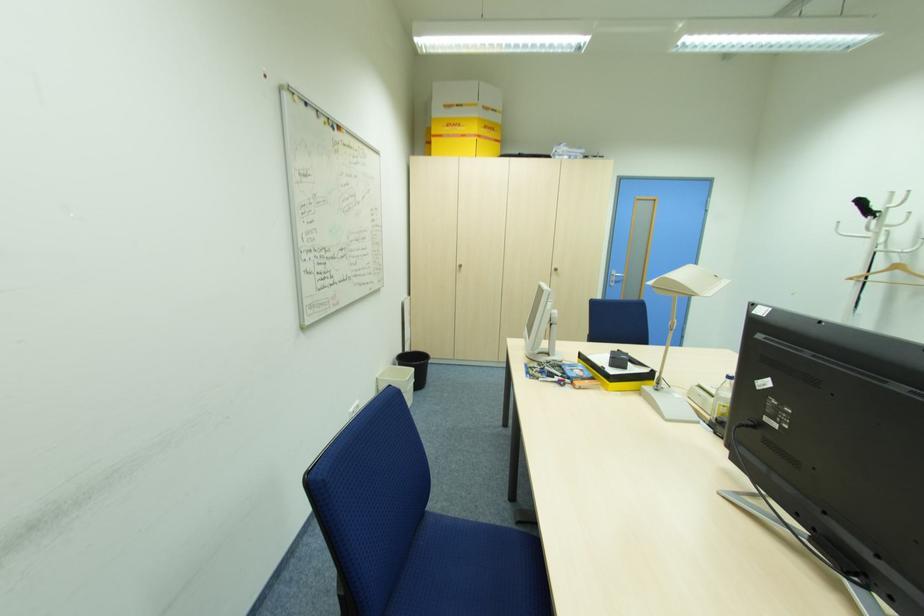
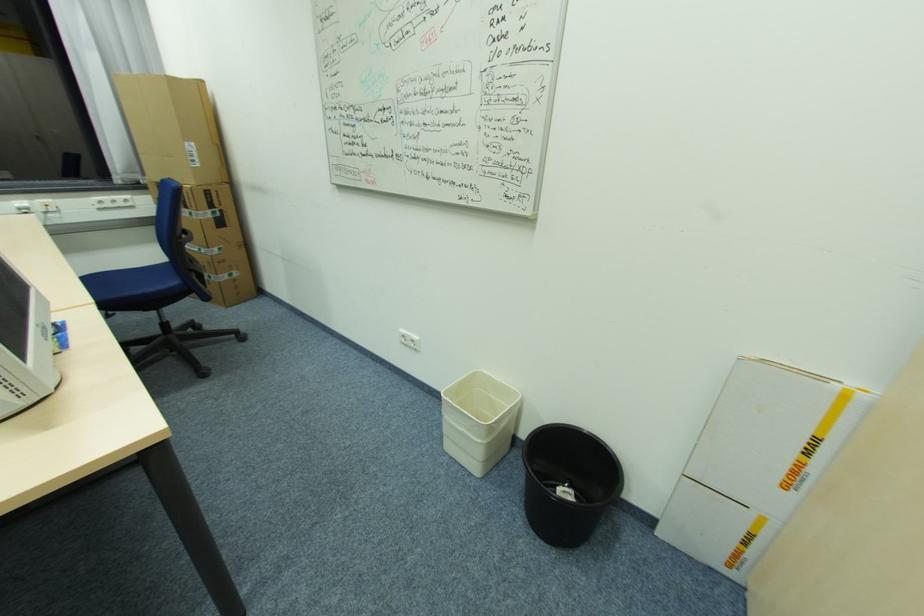
In the second image, find the point that corresponds to [427,389] in the first image.

(533, 532)